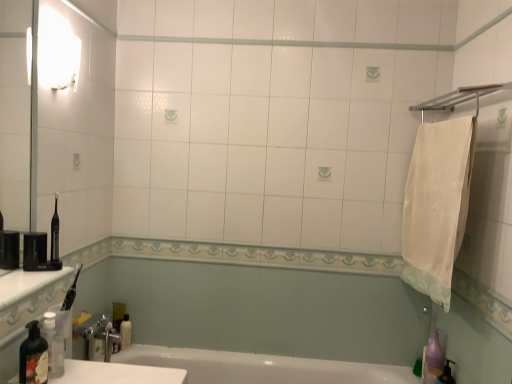
Find the location of a particular element. Image resolution: width=512 pixels, height=384 pixels. white cotton towel at right is located at coordinates (437, 205).

Locate an element on the screen. This screenshot has width=512, height=384. translucent plastic soap dispenser at lower left, the first bottle in the front-to-back sequence is located at coordinates (33, 357).

In the scene shown: Is white cotton towel at right inside white glossy sink at lower left?

No, white cotton towel at right is not a part of white glossy sink at lower left.

Considering the positions of point (119, 370) and point (449, 273), is point (119, 370) closer or farther from the camera than point (449, 273)?

Point (119, 370).

From the image's perspective, between white glossy sink at lower left and white cotton towel at right, which one is located above?

From the image's view, white cotton towel at right is above.

Consider the image. Is white glossy sink at lower left far away from white cotton towel at right?

That's right, there is a large distance between white glossy sink at lower left and white cotton towel at right.

Does translucent plastic soap dispenser at lower left, the first bottle in the front-to-back sequence, have a greater height compared to transparent plastic bottle at lower left, the 2th bottle from the front?

No.

From the image's perspective, does translucent plastic soap dispenser at lower left, the first bottle in the front-to-back sequence, appear higher than transparent plastic bottle at lower left, the 2th bottle from the front?

No, from the image's perspective, translucent plastic soap dispenser at lower left, the first bottle in the front-to-back sequence, is not above transparent plastic bottle at lower left, the 2th bottle from the front.

Looking at their sizes, would you say translucent plastic soap dispenser at lower left, the first bottle in the front-to-back sequence, is wider or thinner than white glossy bottle at lower left?

In the image, translucent plastic soap dispenser at lower left, the first bottle in the front-to-back sequence, appears to be wider than white glossy bottle at lower left.

What's the angular difference between translucent plastic soap dispenser at lower left, the first bottle in the front-to-back sequence, and white glossy bottle at lower left's facing directions?

The angular difference between translucent plastic soap dispenser at lower left, the first bottle in the front-to-back sequence, and white glossy bottle at lower left is 0.0574 degrees.

Is white glossy bottle at lower left inside translucent plastic soap dispenser at lower left, the first bottle in the front-to-back sequence?

No, white glossy bottle at lower left is not inside translucent plastic soap dispenser at lower left, the first bottle in the front-to-back sequence.

Which is closer to the camera, (x=40, y=366) or (x=130, y=338)?

The point (x=40, y=366) is closer to the camera.

What's the angular difference between white cotton towel at right and translucent plastic soap dispenser at lower left, the first bottle in the front-to-back sequence,'s facing directions?

The angular difference between white cotton towel at right and translucent plastic soap dispenser at lower left, the first bottle in the front-to-back sequence, is 179 degrees.

Which object is thinner, white cotton towel at right or translucent plastic soap dispenser at lower left, arranged as the 2th bottle when viewed from the back?

translucent plastic soap dispenser at lower left, arranged as the 2th bottle when viewed from the back, is thinner.

From the image's perspective, which is above, white cotton towel at right or translucent plastic soap dispenser at lower left, the first bottle in the front-to-back sequence?

From the image's view, white cotton towel at right is above.

Measure the distance between transparent plastic bottle at lower left, the 2th bottle from the front, and white cotton towel at right.

transparent plastic bottle at lower left, the 2th bottle from the front, is 1.51 meters from white cotton towel at right.

Could you tell me if transparent plastic bottle at lower left, the 2th bottle from the front, is facing white cotton towel at right?

No.

Which object is closer to the camera taking this photo, transparent plastic bottle at lower left, the 2th bottle from the front, or white cotton towel at right?

transparent plastic bottle at lower left, the 2th bottle from the front, is in front.

How many degrees apart are the facing directions of transparent plastic bottle at lower left, the 2th bottle from the front, and white cotton towel at right?

179 degrees separate the facing orientations of transparent plastic bottle at lower left, the 2th bottle from the front, and white cotton towel at right.

Can you tell me how much translucent plastic soap dispenser at lower left, the first bottle in the front-to-back sequence, and white cotton towel at right differ in facing direction?

179 degrees.

Can you confirm if translucent plastic soap dispenser at lower left, arranged as the 2th bottle when viewed from the back, is shorter than white cotton towel at right?

Yes, translucent plastic soap dispenser at lower left, arranged as the 2th bottle when viewed from the back, is shorter than white cotton towel at right.

Considering the sizes of objects translucent plastic soap dispenser at lower left, arranged as the 2th bottle when viewed from the back, and white cotton towel at right in the image provided, who is smaller, translucent plastic soap dispenser at lower left, arranged as the 2th bottle when viewed from the back, or white cotton towel at right?

translucent plastic soap dispenser at lower left, arranged as the 2th bottle when viewed from the back, is smaller.

Is translucent plastic soap dispenser at lower left, the first bottle in the front-to-back sequence, positioned far away from white cotton towel at right?

Yes.

Is transparent plastic bottle at lower left, the 2th bottle from the front, shorter than white glossy sink at lower left?

Indeed, transparent plastic bottle at lower left, the 2th bottle from the front, has a lesser height compared to white glossy sink at lower left.

Is white glossy sink at lower left a part of transparent plastic bottle at lower left, the 2th bottle from the front?

No, white glossy sink at lower left is located outside of transparent plastic bottle at lower left, the 2th bottle from the front.

The width and height of the screenshot is (512, 384). In order to click on bath towel located above the white glossy sink at lower left (from a real-world perspective) in this screenshot , I will do `click(437, 205)`.

At what (x,y) coordinates should I click in order to perform the action: click on bottle in front of the transparent plastic bottle at lower left, the first bottle viewed from the back. Please return your answer as a coordinate pair (x, y). The width and height of the screenshot is (512, 384). Looking at the image, I should click on (33, 357).

Considering their positions, is translucent plastic soap dispenser at lower left, arranged as the 2th bottle when viewed from the back, positioned closer to transparent plastic bottle at lower left, the first bottle viewed from the back, than white glossy bottle at lower left?

translucent plastic soap dispenser at lower left, arranged as the 2th bottle when viewed from the back.

Consider the image. Considering their positions, is white glossy sink at lower left positioned closer to translucent plastic soap dispenser at lower left, arranged as the 2th bottle when viewed from the back, than white cotton towel at right?

Among the two, white glossy sink at lower left is located nearer to translucent plastic soap dispenser at lower left, arranged as the 2th bottle when viewed from the back.

From the picture: Considering their positions, is translucent plastic soap dispenser at lower left, arranged as the 2th bottle when viewed from the back, positioned closer to white glossy sink at lower left than white glossy bottle at lower left?

translucent plastic soap dispenser at lower left, arranged as the 2th bottle when viewed from the back.

Looking at the image, which one is located further to white glossy sink at lower left, white cotton towel at right or transparent plastic bottle at lower left, the first bottle viewed from the back?

white cotton towel at right lies further to white glossy sink at lower left than the other object.

Estimate the real-world distances between objects in this image. Which object is further from white glossy bottle at lower left, transparent plastic bottle at lower left, the 2th bottle from the front, or white glossy sink at lower left?

The object further to white glossy bottle at lower left is white glossy sink at lower left.

From the image, which object appears to be nearer to white cotton towel at right, translucent plastic soap dispenser at lower left, the first bottle in the front-to-back sequence, or white glossy bottle at lower left?

translucent plastic soap dispenser at lower left, the first bottle in the front-to-back sequence, is closer to white cotton towel at right.

From the image, which object appears to be farther from translucent plastic soap dispenser at lower left, arranged as the 2th bottle when viewed from the back, white cotton towel at right or white glossy bottle at lower left?

white cotton towel at right is positioned further to the anchor translucent plastic soap dispenser at lower left, arranged as the 2th bottle when viewed from the back.

Looking at this image, estimate the real-world distances between objects in this image. Which object is closer to white glossy bottle at lower left, transparent plastic bottle at lower left, the 2th bottle from the front, or translucent plastic soap dispenser at lower left, arranged as the 2th bottle when viewed from the back?

transparent plastic bottle at lower left, the 2th bottle from the front, lies closer to white glossy bottle at lower left than the other object.

The width and height of the screenshot is (512, 384). I want to click on sink located between translucent plastic soap dispenser at lower left, the first bottle in the front-to-back sequence, and white glossy bottle at lower left in the depth direction, so tap(115, 369).

Locate an element on the screen. This screenshot has height=384, width=512. sink between translucent plastic soap dispenser at lower left, arranged as the 2th bottle when viewed from the back, and white cotton towel at right, in the horizontal direction is located at coordinates (115, 369).

Where is `sink between transparent plastic bottle at lower left, the 2th bottle from the front, and white glossy bottle at lower left, along the z-axis`? The height and width of the screenshot is (384, 512). sink between transparent plastic bottle at lower left, the 2th bottle from the front, and white glossy bottle at lower left, along the z-axis is located at coordinates (115, 369).

Locate an element on the screen. The width and height of the screenshot is (512, 384). sink situated between white glossy bottle at lower left and white cotton towel at right from left to right is located at coordinates (115, 369).